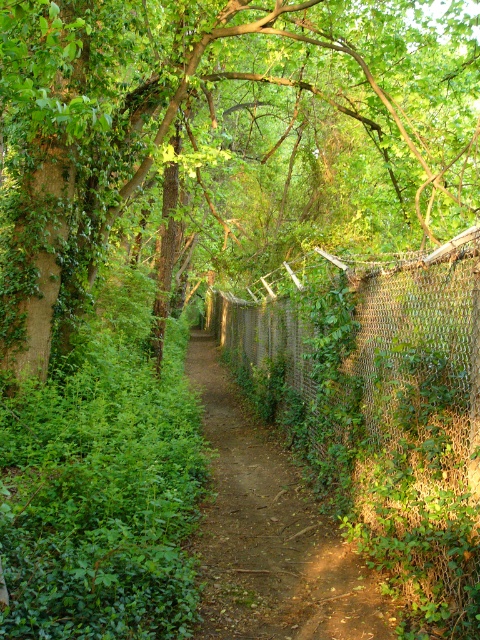
Question: Among these objects, which one is farthest from the camera?

Choices:
 (A) green chain-link fence at center-right
 (B) green leafy tree at center

Answer: (B)

Question: Which object is farther from the camera taking this photo?

Choices:
 (A) green leafy tree at center
 (B) green chain-link fence at center-right

Answer: (A)

Question: Is green leafy tree at center below green chain-link fence at center-right?

Choices:
 (A) yes
 (B) no

Answer: (B)

Question: Is green leafy tree at center to the left of green chain-link fence at center-right from the viewer's perspective?

Choices:
 (A) no
 (B) yes

Answer: (B)

Question: Is green leafy tree at center thinner than green chain-link fence at center-right?

Choices:
 (A) yes
 (B) no

Answer: (B)